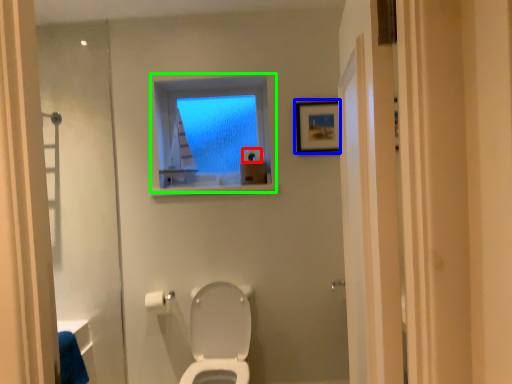
Question: Which object is positioned farthest from toilet paper (highlighted by a red box)? Select from picture frame (highlighted by a blue box) and window (highlighted by a green box).

Choices:
 (A) picture frame
 (B) window

Answer: (A)